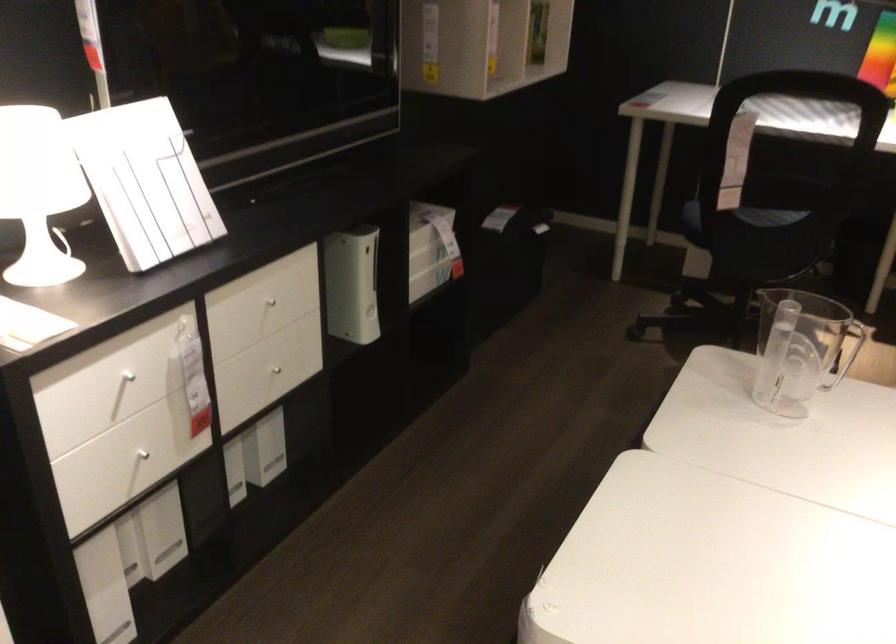
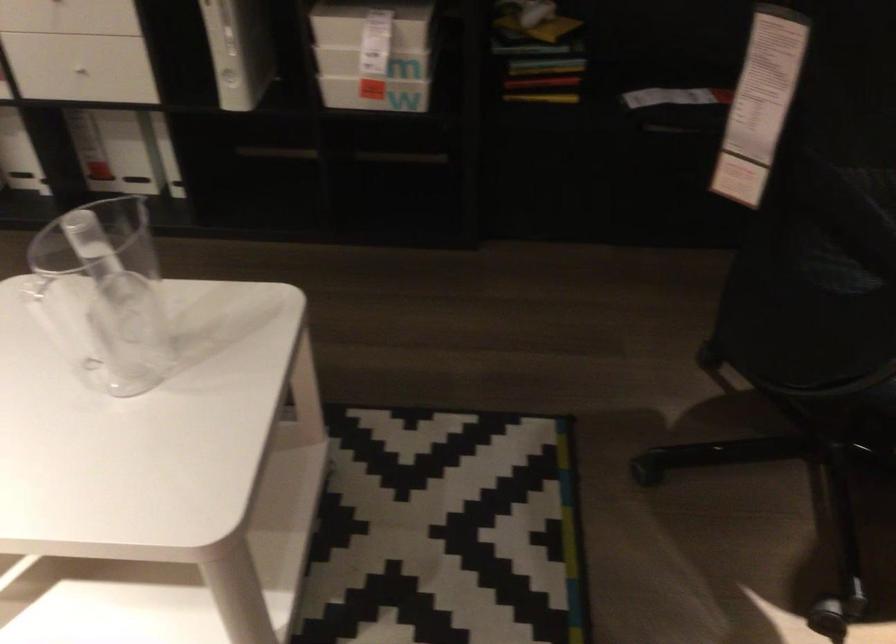
In the second image, find the point that corresponds to the point at 409,237 in the first image.

(371, 24)